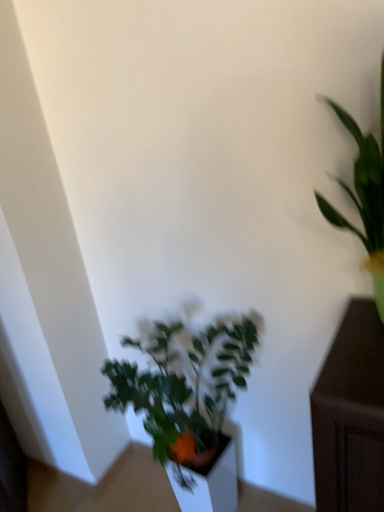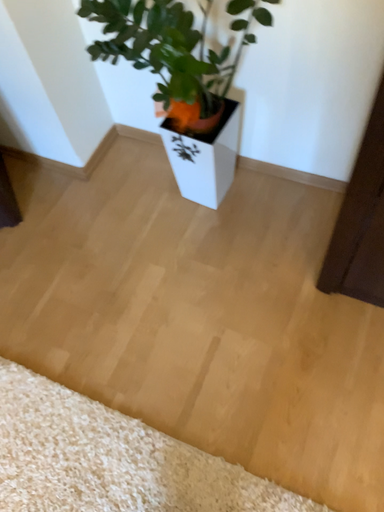
Question: Which way did the camera rotate in the video?

Choices:
 (A) rotated upward
 (B) rotated downward

Answer: (B)